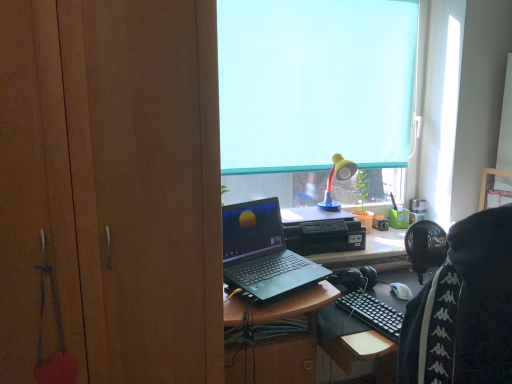
Question: Could you tell me if black matte laptop at center is facing wooden cabinet at left?

Choices:
 (A) yes
 (B) no

Answer: (B)

Question: Does black matte laptop at center have a larger size compared to wooden cabinet at left?

Choices:
 (A) yes
 (B) no

Answer: (B)

Question: Can you confirm if black matte laptop at center is positioned to the left of wooden cabinet at left?

Choices:
 (A) no
 (B) yes

Answer: (A)

Question: Is black matte laptop at center positioned behind wooden cabinet at left?

Choices:
 (A) no
 (B) yes

Answer: (B)

Question: Can you confirm if black matte laptop at center is taller than wooden cabinet at left?

Choices:
 (A) yes
 (B) no

Answer: (B)

Question: From the image's perspective, does black matte laptop at center appear higher than wooden cabinet at left?

Choices:
 (A) no
 (B) yes

Answer: (A)

Question: Is black matte laptop at center wider than blue fabric at upper center?

Choices:
 (A) no
 (B) yes

Answer: (B)

Question: Would you say black matte laptop at center is a long distance from blue fabric at upper center?

Choices:
 (A) no
 (B) yes

Answer: (A)

Question: Would you say blue fabric at upper center is part of black matte laptop at center's contents?

Choices:
 (A) no
 (B) yes

Answer: (A)

Question: Can we say black matte laptop at center lies outside blue fabric at upper center?

Choices:
 (A) yes
 (B) no

Answer: (A)

Question: Considering the relative sizes of black matte laptop at center and blue fabric at upper center in the image provided, is black matte laptop at center bigger than blue fabric at upper center?

Choices:
 (A) yes
 (B) no

Answer: (A)

Question: From the image's perspective, is black matte laptop at center located above blue fabric at upper center?

Choices:
 (A) yes
 (B) no

Answer: (B)

Question: Does wooden cabinet at left have a smaller size compared to yellow matte lamp at upper center?

Choices:
 (A) yes
 (B) no

Answer: (B)